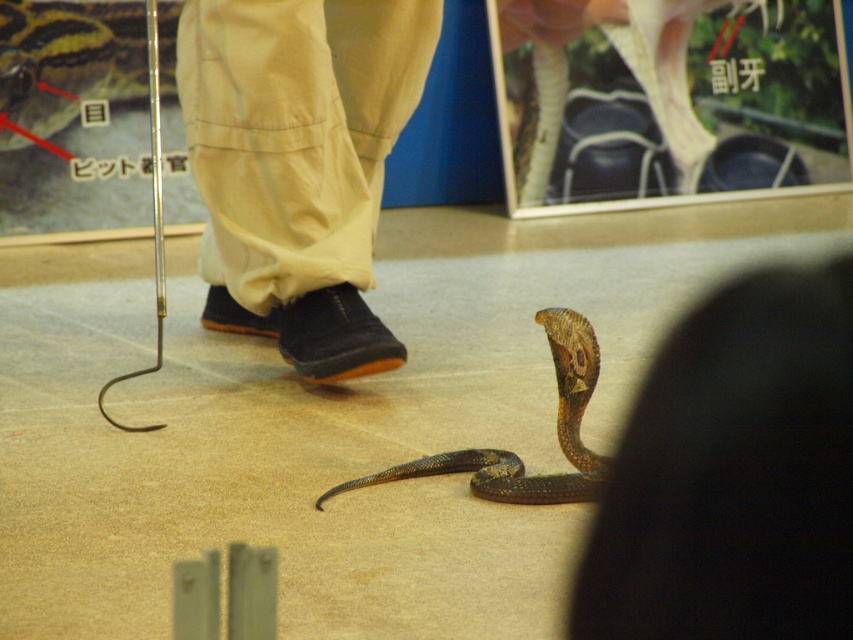
Question: Which object appears closest to the camera in this image?

Choices:
 (A) shiny brown snake at center
 (B) shiny black snake at center

Answer: (A)

Question: Does matte brown snake at lower center have a lesser width compared to shiny white snake at center?

Choices:
 (A) yes
 (B) no

Answer: (A)

Question: Does matte brown snake at lower center have a lesser width compared to shiny black snake at center?

Choices:
 (A) no
 (B) yes

Answer: (B)

Question: Among these points, which one is farthest from the camera?

Choices:
 (A) (560, 492)
 (B) (634, 12)
 (C) (22, 83)
 (D) (605, 611)

Answer: (B)

Question: Is matte brown snake at lower center thinner than shiny white snake at center?

Choices:
 (A) yes
 (B) no

Answer: (A)

Question: Which is nearer to the shiny black snake at center?

Choices:
 (A) shiny brown snake at center
 (B) shiny white snake at center
 (C) matte brown snake at lower center

Answer: (B)